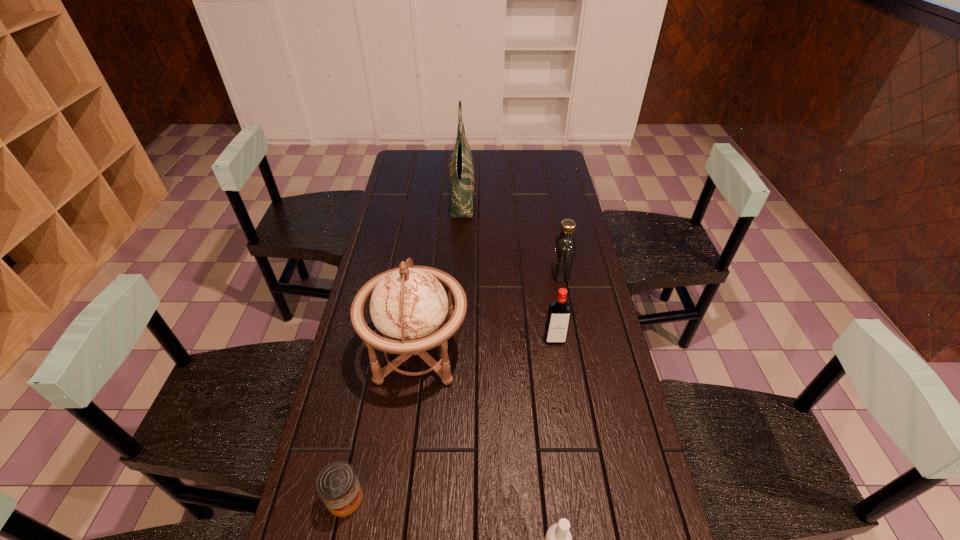
This screenshot has width=960, height=540. What are the coordinates of `vacant space located 0.140m on the front-facing side of the farthest vodka` in the screenshot? It's located at (512, 273).

This screenshot has width=960, height=540. I want to click on free space located 0.280m on the front and back of the second farthest vodka, so click(x=569, y=436).

This screenshot has width=960, height=540. In order to click on vacant space located on the back of the shortest object in this screenshot , I will do `click(372, 372)`.

Identify the location of object present at the far edge. This screenshot has height=540, width=960. (461, 167).

Identify the location of globe at the left edge. (409, 306).

Image resolution: width=960 pixels, height=540 pixels. I want to click on can at the left edge, so click(x=337, y=484).

Locate an element on the screen. Image resolution: width=960 pixels, height=540 pixels. free space at the far edge is located at coordinates (431, 163).

Where is `vacant region at the left edge of the desktop`? vacant region at the left edge of the desktop is located at coordinates (385, 222).

The height and width of the screenshot is (540, 960). I want to click on vacant space at the right edge, so click(x=537, y=199).

At what (x,y) coordinates should I click in order to perform the action: click on vacant space at the far left corner of the desktop. Please return your answer as a coordinate pair (x, y). Looking at the image, I should click on (413, 173).